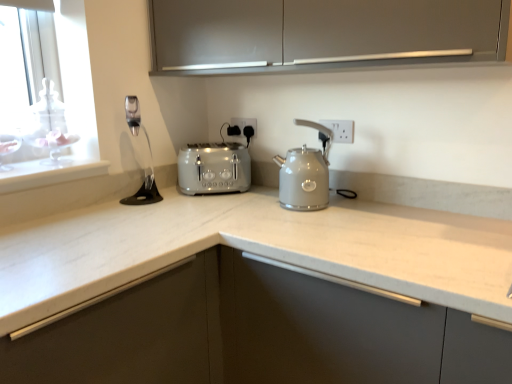
Question: Can you confirm if satin silver toaster at center is thinner than satin nickel faucet at upper left?

Choices:
 (A) yes
 (B) no

Answer: (B)

Question: Is satin silver toaster at center facing away from satin nickel faucet at upper left?

Choices:
 (A) yes
 (B) no

Answer: (B)

Question: Is satin silver toaster at center not close to satin nickel faucet at upper left?

Choices:
 (A) no
 (B) yes

Answer: (A)

Question: Considering the relative positions of satin silver toaster at center and satin nickel faucet at upper left in the image provided, is satin silver toaster at center to the right of satin nickel faucet at upper left from the viewer's perspective?

Choices:
 (A) no
 (B) yes

Answer: (B)

Question: Is satin silver toaster at center directly adjacent to satin nickel faucet at upper left?

Choices:
 (A) yes
 (B) no

Answer: (B)

Question: Does satin silver toaster at center have a greater width compared to satin nickel faucet at upper left?

Choices:
 (A) yes
 (B) no

Answer: (A)

Question: From a real-world perspective, is satin silver toaster at center under satin finish cabinet at upper center?

Choices:
 (A) yes
 (B) no

Answer: (A)

Question: Is satin silver toaster at center thinner than satin finish cabinet at upper center?

Choices:
 (A) no
 (B) yes

Answer: (B)

Question: Does satin silver toaster at center lie in front of satin finish cabinet at upper center?

Choices:
 (A) yes
 (B) no

Answer: (B)

Question: Is the depth of satin silver toaster at center greater than that of satin finish cabinet at upper center?

Choices:
 (A) no
 (B) yes

Answer: (B)

Question: Is satin silver toaster at center to the left of satin finish cabinet at upper center from the viewer's perspective?

Choices:
 (A) no
 (B) yes

Answer: (B)

Question: Are satin silver toaster at center and satin finish cabinet at upper center making contact?

Choices:
 (A) yes
 (B) no

Answer: (B)

Question: From the image's perspective, is satin finish cabinet at upper center below satin silver toaster at center?

Choices:
 (A) no
 (B) yes

Answer: (A)